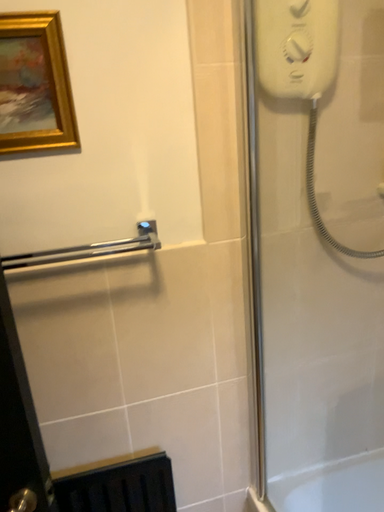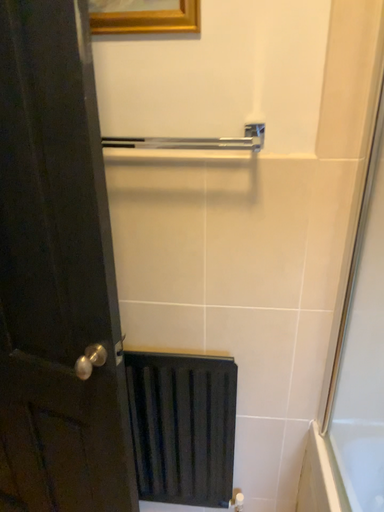
Question: Which way did the camera rotate in the video?

Choices:
 (A) rotated upward
 (B) rotated downward

Answer: (B)